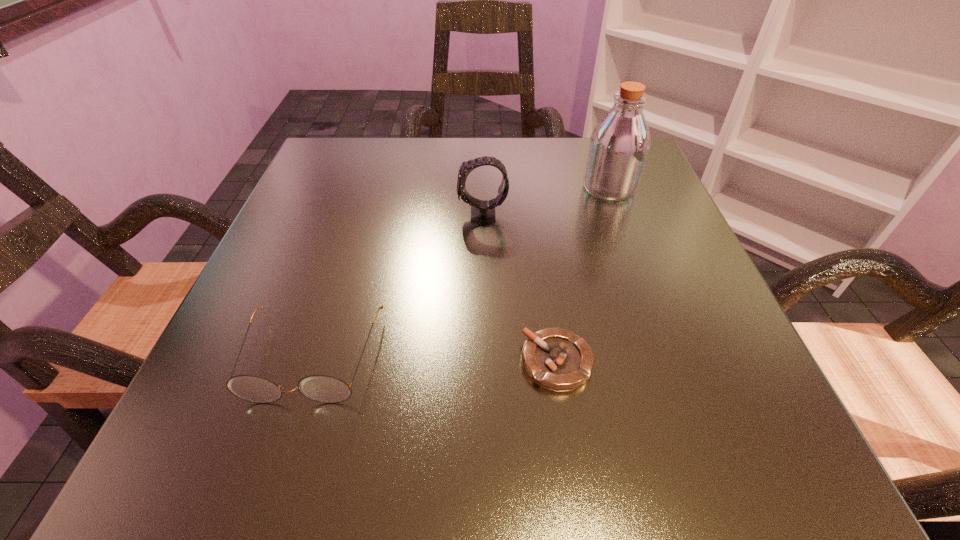
Identify the location of vacant area situated 0.200m on the face of the second object from left to right. The image size is (960, 540). (352, 215).

The width and height of the screenshot is (960, 540). What are the coordinates of `vacant region located 0.270m on the face of the second object from left to right` in the screenshot? It's located at (316, 215).

Where is `vacant area situated on the back of the ashtray`? Image resolution: width=960 pixels, height=540 pixels. vacant area situated on the back of the ashtray is located at coordinates (545, 284).

The image size is (960, 540). What are the coordinates of `object located at the far edge` in the screenshot? It's located at (619, 145).

The width and height of the screenshot is (960, 540). I want to click on object located at the left edge, so click(x=321, y=388).

You are a GUI agent. You are given a task and a screenshot of the screen. Output one action in this format:
    pyautogui.click(x=<x>, y=<y>)
    Task: Click on the object positioned at the right edge
    
    Given the screenshot: What is the action you would take?
    pos(619,145)

The width and height of the screenshot is (960, 540). What are the coordinates of `object that is at the far right corner` in the screenshot? It's located at (619, 145).

Where is `free space at the far edge of the desktop`? Image resolution: width=960 pixels, height=540 pixels. free space at the far edge of the desktop is located at coordinates (564, 144).

The image size is (960, 540). In order to click on vacant space at the near edge in this screenshot , I will do `click(640, 469)`.

This screenshot has height=540, width=960. In order to click on vacant space at the left edge of the desktop in this screenshot , I will do `click(276, 231)`.